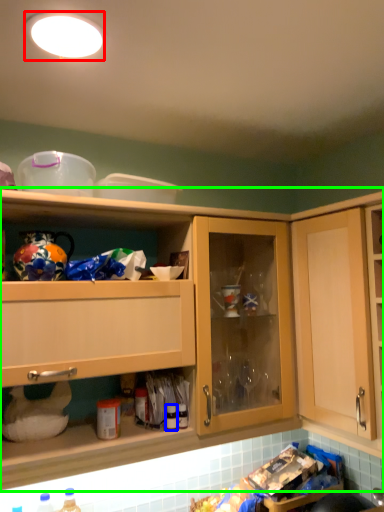
Question: Estimate the real-world distances between objects in this image. Which object is farther from lighting (highlighted by a red box), bottle (highlighted by a blue box) or cabinetry (highlighted by a green box)?

Choices:
 (A) bottle
 (B) cabinetry

Answer: (A)